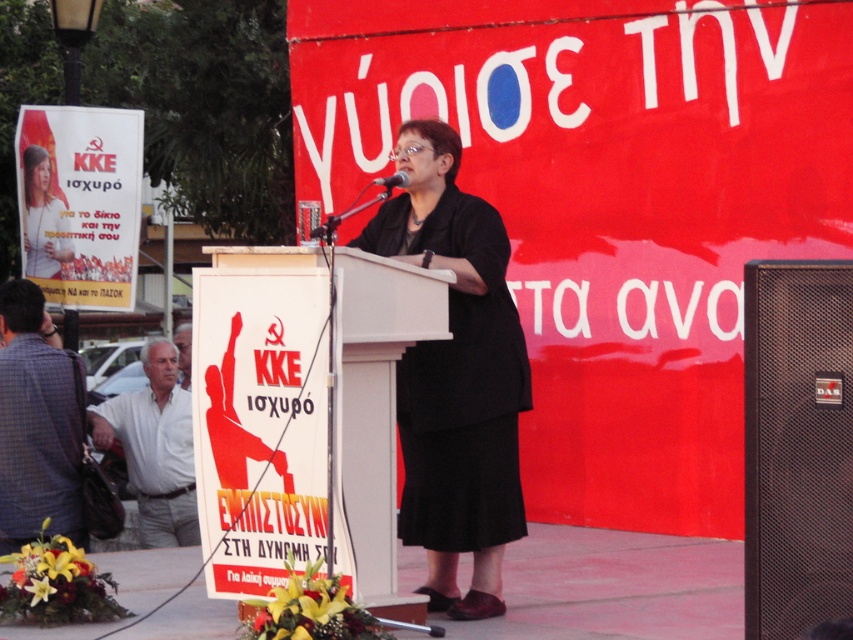
You are an event organizer who needs to adjust the microphone height for the speaker. The microphone is attached to the black mesh speaker at center. Considering the white wood podium at center, which is taller, will you need to raise or lower the microphone to ensure the speaker can reach it comfortably?

The white wood podium at center is taller than the black mesh speaker at center. To ensure the speaker can reach the microphone comfortably, you should raise the microphone attached to the black mesh speaker at center so it reaches the speaker standing at the taller podium.

You are attending an outdoor event with a large red backdrop and a speaker at the center. The speaker is wearing a dark blazer and glasses. There is a point marked at coordinates (798, 444). What object is located at this coordinate?

The point at coordinates (798, 444) indicates the black mesh speaker at center.

You are an event organizer who needs to adjust the microphone placement so that it is centered relative to the podium. Currently, the white wood podium at center and the matte black microphone at center are not aligned. Which object should you move to achieve this?

The white wood podium at center is positioned on the left side of the matte black microphone at center, so to center the microphone relative to the podium, you should move the white wood podium at center to the right until it is directly behind the microphone.